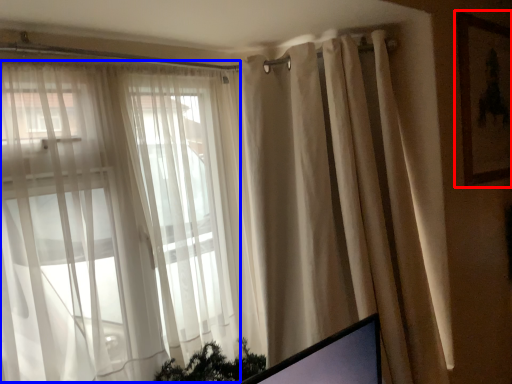
Question: Which object is further to the camera taking this photo, picture frame (highlighted by a red box) or bay window (highlighted by a blue box)?

Choices:
 (A) picture frame
 (B) bay window

Answer: (A)